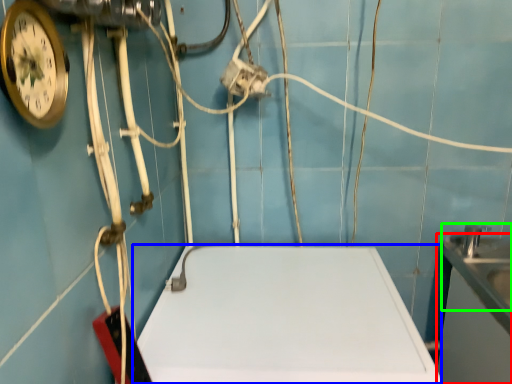
Question: Considering the real-world distances, which object is farthest from counter top (highlighted by a red box)? counter top (highlighted by a blue box) or sink (highlighted by a green box)?

Choices:
 (A) counter top
 (B) sink

Answer: (A)